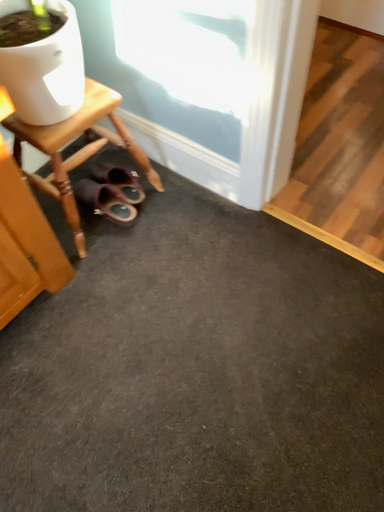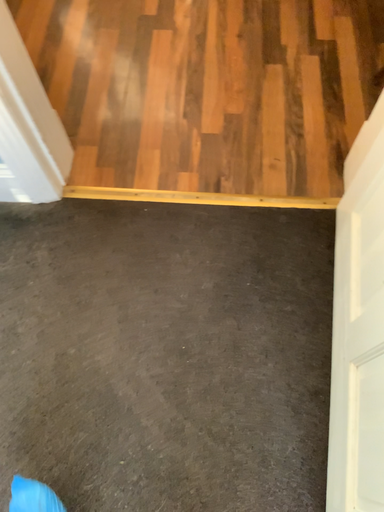
Question: How did the camera likely rotate when shooting the video?

Choices:
 (A) rotated right
 (B) rotated left

Answer: (A)